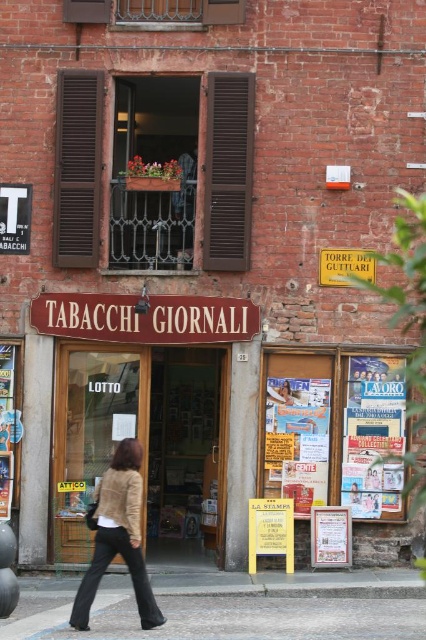
Measure the distance between gray concrete pavement at lower center and beige fuzzy jacket at lower left.

gray concrete pavement at lower center is 3.79 feet away from beige fuzzy jacket at lower left.

Does gray concrete pavement at lower center appear under beige fuzzy jacket at lower left?

Correct, gray concrete pavement at lower center is located below beige fuzzy jacket at lower left.

Is point (201, 624) positioned behind point (109, 522)?

Yes, point (201, 624) is farther from viewer.

In order to click on gray concrete pavement at lower center in this screenshot , I will do `click(264, 618)`.